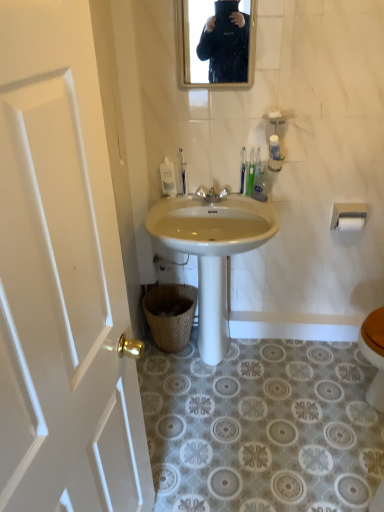
Question: Is white glossy sink at center at the left side of white matte toilet paper at upper right, the 2th toilet paper when ordered from bottom to top?

Choices:
 (A) no
 (B) yes

Answer: (B)

Question: From a real-world perspective, is white glossy sink at center under white matte toilet paper at upper right, acting as the 1th toilet paper starting from the top?

Choices:
 (A) no
 (B) yes

Answer: (B)

Question: Is white glossy sink at center positioned behind white matte toilet paper at upper right, the 2th toilet paper when ordered from bottom to top?

Choices:
 (A) no
 (B) yes

Answer: (A)

Question: Does white glossy sink at center have a larger size compared to white matte toilet paper at upper right, the 2th toilet paper when ordered from bottom to top?

Choices:
 (A) yes
 (B) no

Answer: (A)

Question: From a real-world perspective, is white glossy sink at center positioned over white matte toilet paper at upper right, the 2th toilet paper when ordered from bottom to top, based on gravity?

Choices:
 (A) yes
 (B) no

Answer: (B)

Question: Is white glossy sink at center in front of or behind white plastic soap dispenser at center in the image?

Choices:
 (A) front
 (B) behind

Answer: (A)

Question: Is white glossy sink at center to the left or to the right of white plastic soap dispenser at center in the image?

Choices:
 (A) right
 (B) left

Answer: (A)

Question: Does point click(x=198, y=260) appear closer or farther from the camera than point click(x=173, y=193)?

Choices:
 (A) farther
 (B) closer

Answer: (A)

Question: Which is correct: white glossy sink at center is inside white plastic soap dispenser at center, or outside of it?

Choices:
 (A) outside
 (B) inside

Answer: (A)

Question: Is green plastic toothbrush at upper center in front of or behind matte black mirror at upper center in the image?

Choices:
 (A) behind
 (B) front

Answer: (A)

Question: Is point (254, 178) closer or farther from the camera than point (243, 50)?

Choices:
 (A) closer
 (B) farther

Answer: (B)

Question: In terms of height, does green plastic toothbrush at upper center look taller or shorter compared to matte black mirror at upper center?

Choices:
 (A) short
 (B) tall

Answer: (A)

Question: Is green plastic toothbrush at upper center bigger or smaller than matte black mirror at upper center?

Choices:
 (A) small
 (B) big

Answer: (A)

Question: In the image, is white wood door at left on the left side or the right side of white matte toilet paper at upper right, the 2th toilet paper when ordered from bottom to top?

Choices:
 (A) right
 (B) left

Answer: (B)

Question: From a real-world perspective, relative to white matte toilet paper at upper right, acting as the 1th toilet paper starting from the top, is white wood door at left vertically above or below?

Choices:
 (A) below
 (B) above

Answer: (B)